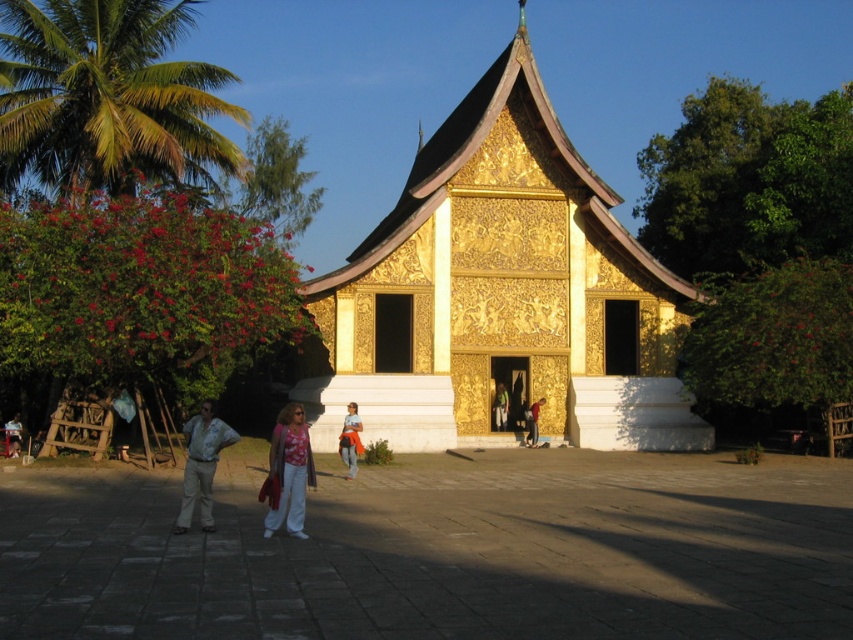
Can you confirm if white cotton shirt at lower left is bigger than orange fabric bag at center?

Correct, white cotton shirt at lower left is larger in size than orange fabric bag at center.

Where is `white cotton shirt at lower left`? The height and width of the screenshot is (640, 853). white cotton shirt at lower left is located at coordinates (201, 465).

Is point (236, 436) less distant than point (496, 413)?

Yes, it is in front of point (496, 413).

Can you confirm if white cotton shirt at lower left is thinner than green fabric at center?

In fact, white cotton shirt at lower left might be wider than green fabric at center.

Is point (195, 449) more distant than point (498, 394)?

No.

What are the coordinates of `white cotton shirt at lower left` in the screenshot? It's located at (201, 465).

This screenshot has height=640, width=853. What do you see at coordinates (107, 97) in the screenshot? I see `green leafy palm tree at upper left` at bounding box center [107, 97].

How distant is green leafy palm tree at upper left from matte pink blouse at center?

The distance of green leafy palm tree at upper left from matte pink blouse at center is 31.81 meters.

In order to click on green leafy palm tree at upper left in this screenshot , I will do `click(107, 97)`.